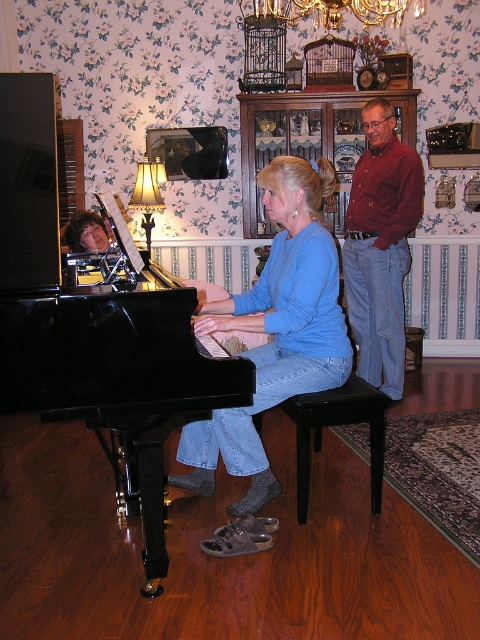
Is blue cotton shirt at center below red shirt at right?

Correct, blue cotton shirt at center is located below red shirt at right.

Describe the element at coordinates (275, 332) in the screenshot. I see `blue cotton shirt at center` at that location.

The width and height of the screenshot is (480, 640). What are the coordinates of `blue cotton shirt at center` in the screenshot? It's located at (275, 332).

Can you confirm if black glossy piano at left is bigger than black wood stool at center?

Indeed, black glossy piano at left has a larger size compared to black wood stool at center.

Which of these two, black glossy piano at left or black wood stool at center, stands shorter?

With less height is black wood stool at center.

Locate an element on the screen. The height and width of the screenshot is (640, 480). black glossy piano at left is located at coordinates (95, 324).

Between black glossy piano at left and gold crystal chandelier at upper center, which one has more height?

Standing taller between the two is black glossy piano at left.

Is black glossy piano at left taller than gold crystal chandelier at upper center?

Yes.

Is point (24, 401) farther from camera compared to point (303, 16)?

No, it is in front of (303, 16).

Where is `black glossy piano at left`? The image size is (480, 640). black glossy piano at left is located at coordinates (95, 324).